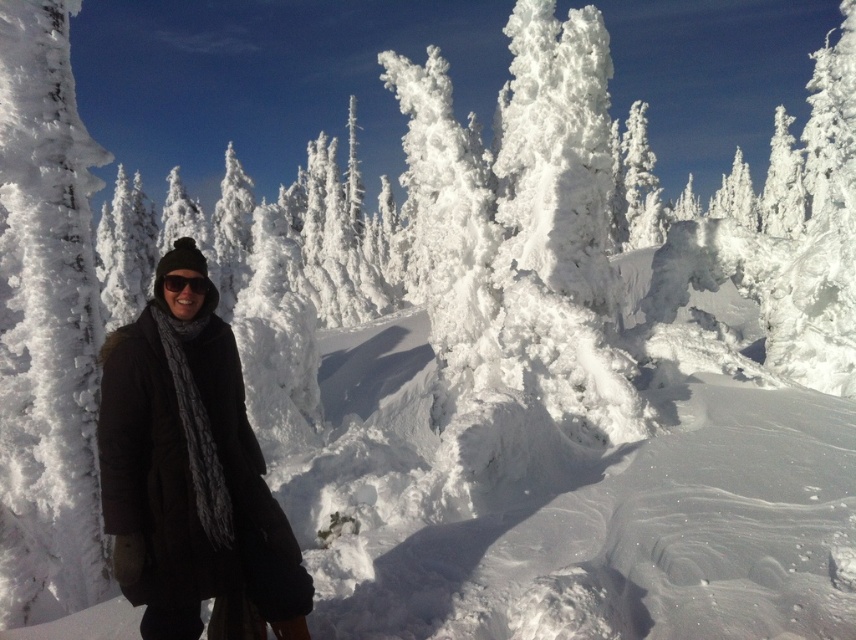
Question: Can you confirm if black woolen coat at center is wider than black matte sunglasses at center?

Choices:
 (A) yes
 (B) no

Answer: (A)

Question: Which of the following is the farthest from the observer?

Choices:
 (A) black matte sunglasses at center
 (B) white frosty tree at upper right
 (C) black woolen coat at center

Answer: (B)

Question: Which point is farther from the camera taking this photo?

Choices:
 (A) (186, 280)
 (B) (771, 225)

Answer: (B)

Question: Which object is farther from the camera taking this photo?

Choices:
 (A) black woolen coat at center
 (B) black matte sunglasses at center

Answer: (B)

Question: Is white frosty tree at upper right positioned at the back of black matte sunglasses at center?

Choices:
 (A) no
 (B) yes

Answer: (B)

Question: Can you confirm if black woolen coat at center is positioned below black matte sunglasses at center?

Choices:
 (A) yes
 (B) no

Answer: (A)